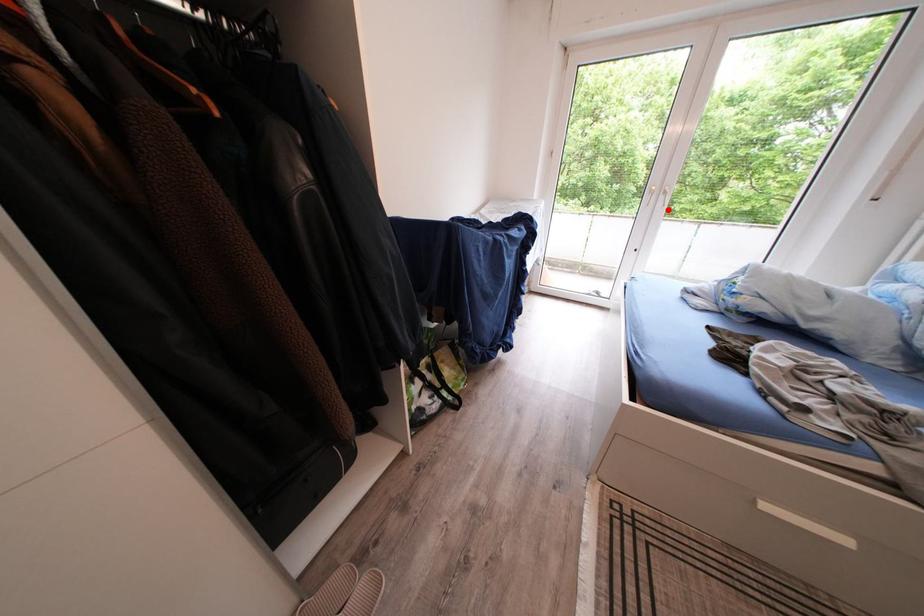
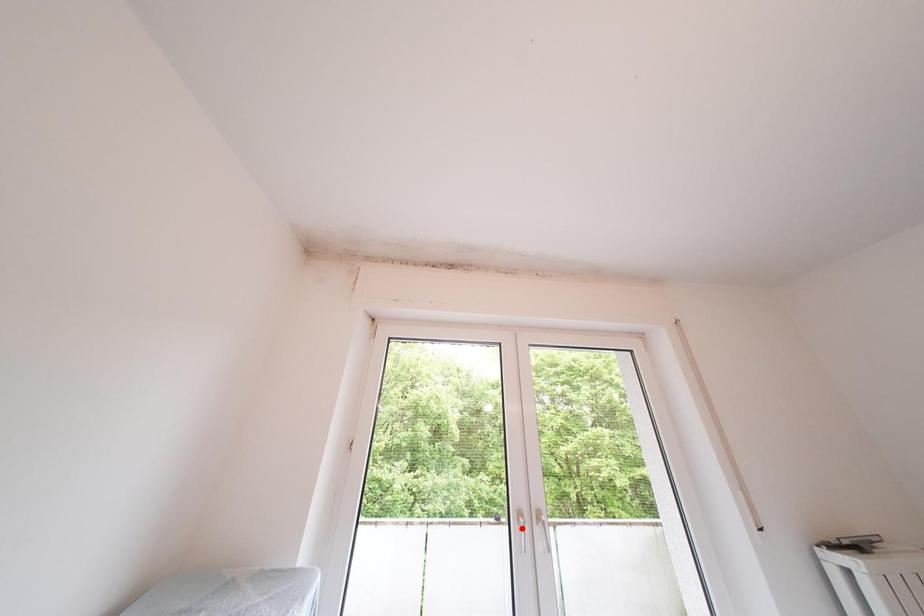
I am providing you with two images of the same scene from different viewpoints. A red point is marked on the first image and another point is marked on the second image. Is the marked point in image1 the same physical position as the marked point in image2?

No